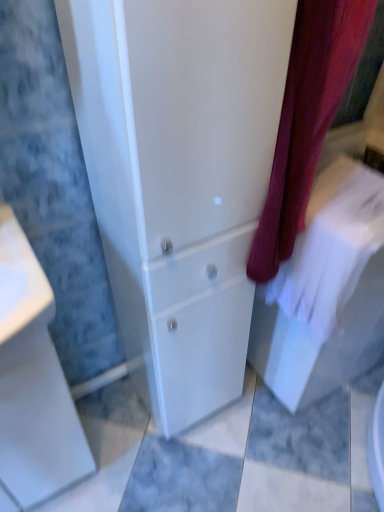
Question: Is the position of white glossy cabinet at center less distant than that of velvet burgundy curtain at center?

Choices:
 (A) no
 (B) yes

Answer: (B)

Question: Is white glossy cabinet at center further to the viewer compared to velvet burgundy curtain at center?

Choices:
 (A) yes
 (B) no

Answer: (B)

Question: From a real-world perspective, is white glossy cabinet at center physically above velvet burgundy curtain at center?

Choices:
 (A) yes
 (B) no

Answer: (B)

Question: Considering the relative sizes of white glossy cabinet at center and velvet burgundy curtain at center in the image provided, is white glossy cabinet at center taller than velvet burgundy curtain at center?

Choices:
 (A) yes
 (B) no

Answer: (A)

Question: Is white glossy cabinet at center surrounding velvet burgundy curtain at center?

Choices:
 (A) yes
 (B) no

Answer: (B)

Question: Is white glossy cabinet at center next to velvet burgundy curtain at center and touching it?

Choices:
 (A) yes
 (B) no

Answer: (B)

Question: Considering the relative sizes of velvet burgundy curtain at center and white glossy cabinet at center in the image provided, is velvet burgundy curtain at center thinner than white glossy cabinet at center?

Choices:
 (A) no
 (B) yes

Answer: (A)

Question: Considering the relative sizes of velvet burgundy curtain at center and white glossy cabinet at center in the image provided, is velvet burgundy curtain at center bigger than white glossy cabinet at center?

Choices:
 (A) no
 (B) yes

Answer: (A)

Question: From the image's perspective, does velvet burgundy curtain at center appear lower than white glossy cabinet at center?

Choices:
 (A) no
 (B) yes

Answer: (A)

Question: Is velvet burgundy curtain at center smaller than white glossy cabinet at center?

Choices:
 (A) no
 (B) yes

Answer: (B)

Question: From a real-world perspective, does velvet burgundy curtain at center stand above white glossy cabinet at center?

Choices:
 (A) yes
 (B) no

Answer: (A)

Question: Can you confirm if velvet burgundy curtain at center is positioned to the right of white glossy cabinet at center?

Choices:
 (A) no
 (B) yes

Answer: (B)

Question: Is white glossy porcelain at lower left far away from white glossy cabinet at center?

Choices:
 (A) yes
 (B) no

Answer: (B)